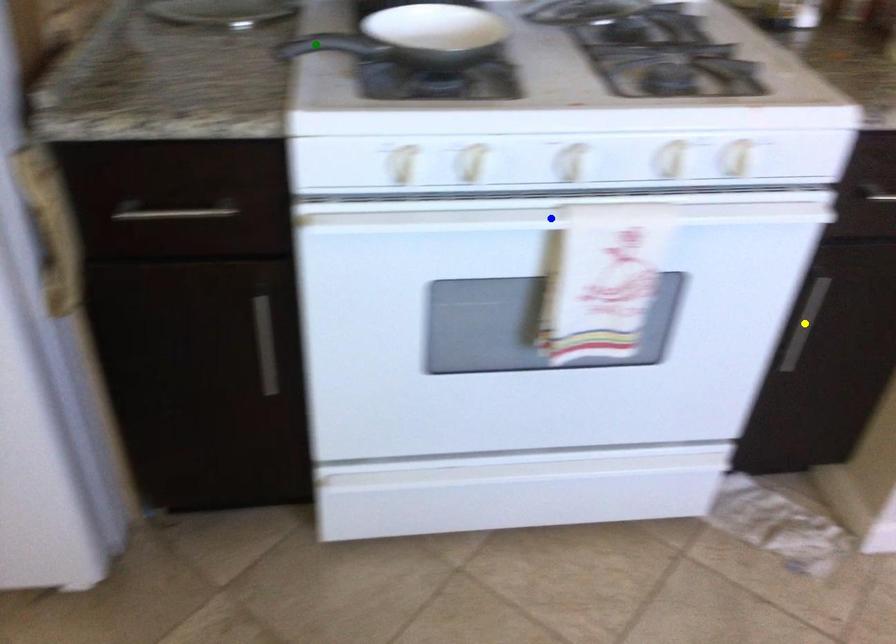
Order these from nearest to farthest:
1. blue point
2. yellow point
3. green point

yellow point < blue point < green point